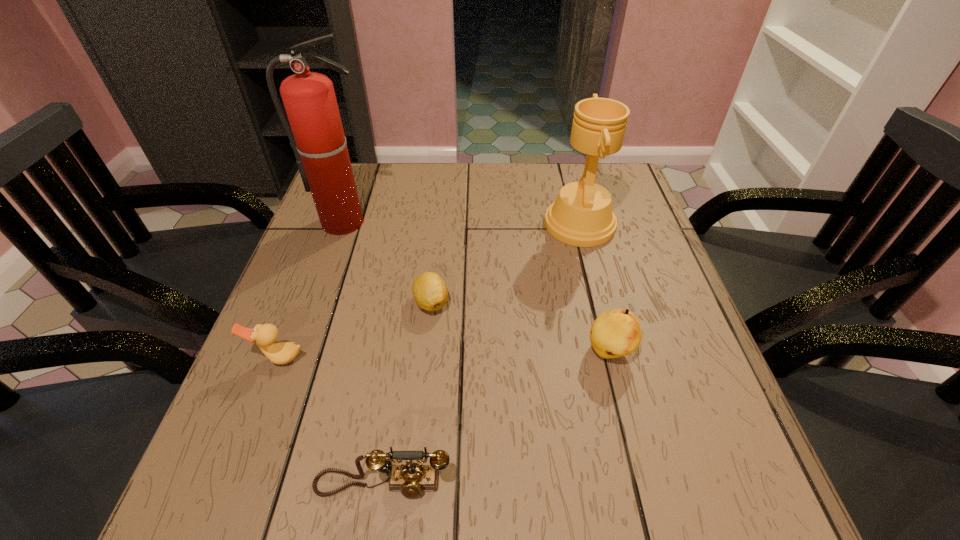
Where is `blank region between the lemon and the award`? This screenshot has width=960, height=540. blank region between the lemon and the award is located at coordinates (506, 264).

Find the location of a particular element. This screenshot has height=540, width=960. free spot between the duck and the shortest object is located at coordinates pos(355,330).

Locate an element on the screen. object that is the fifth closest to the fourth nearest object is located at coordinates (411, 479).

Identify the location of object that is the second closest to the telephone. (429, 290).

Where is `vacant region that satisfies the following two spatial constraints: 1. with the nozzle and gauge on the fire extinguisher; 2. on the right side of the fifth shortest object`? The height and width of the screenshot is (540, 960). vacant region that satisfies the following two spatial constraints: 1. with the nozzle and gauge on the fire extinguisher; 2. on the right side of the fifth shortest object is located at coordinates (345, 225).